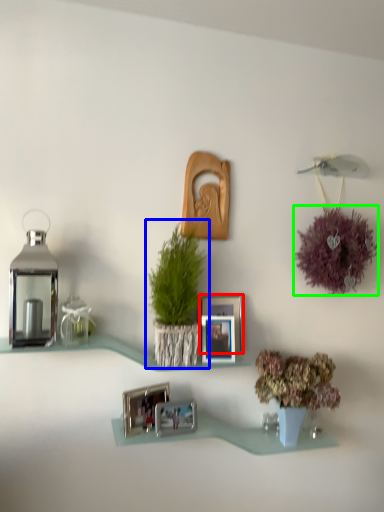
Question: Considering the real-world distances, which object is closest to picture frame (highlighted by a red box)? houseplant (highlighted by a blue box) or flower (highlighted by a green box).

Choices:
 (A) houseplant
 (B) flower

Answer: (A)